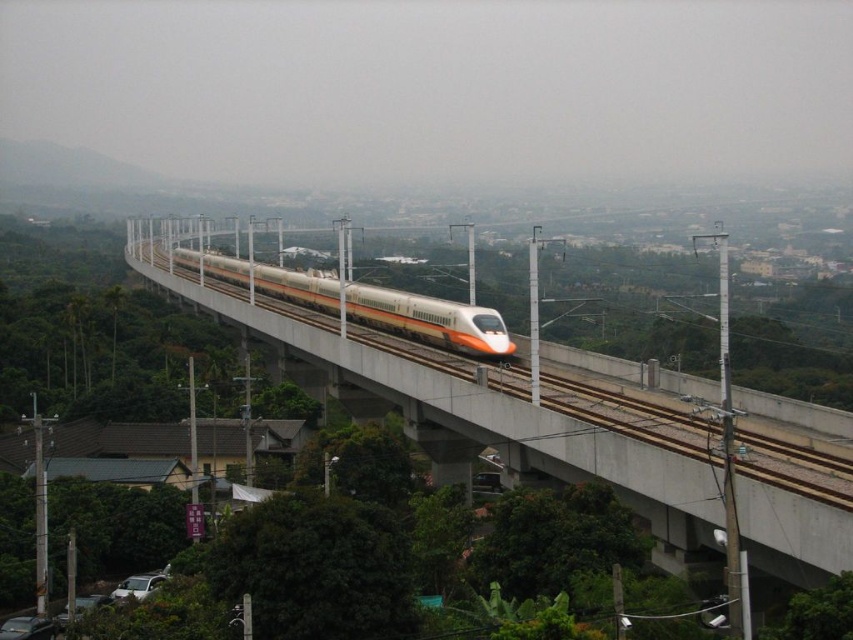
Question: Does white concrete bridge at center lie in front of yellow metallic train track at center?

Choices:
 (A) no
 (B) yes

Answer: (A)

Question: Is white concrete bridge at center closer to the viewer compared to yellow metallic train track at center?

Choices:
 (A) no
 (B) yes

Answer: (A)

Question: Which point is farther to the camera?

Choices:
 (A) yellow metallic train track at center
 (B) white glossy passenger train at center
 (C) white concrete bridge at center

Answer: (B)

Question: Can you confirm if white concrete bridge at center is positioned above white glossy passenger train at center?

Choices:
 (A) no
 (B) yes

Answer: (A)

Question: Which point is farther to the camera?

Choices:
 (A) white concrete bridge at center
 (B) yellow metallic train track at center

Answer: (A)

Question: Among these objects, which one is nearest to the camera?

Choices:
 (A) white glossy passenger train at center
 (B) yellow metallic train track at center
 (C) white concrete bridge at center

Answer: (B)